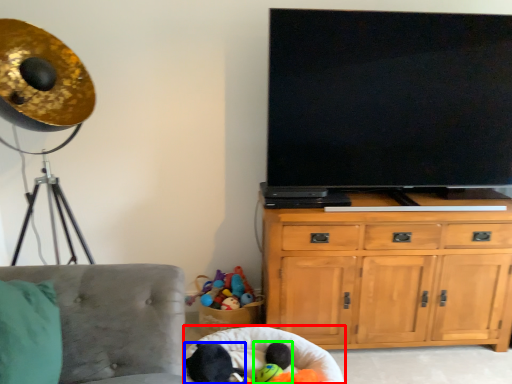
Question: Based on their relative distances, which object is nearer to bean bag chair (highlighted by a red box)? Choose from animal (highlighted by a blue box) and toy (highlighted by a green box).

Choices:
 (A) animal
 (B) toy

Answer: (B)